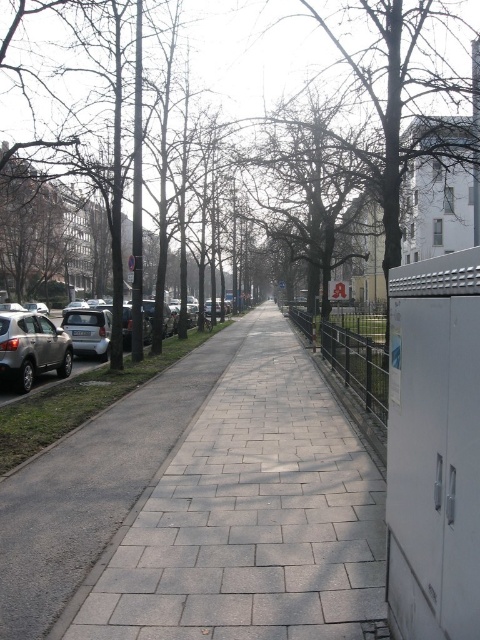
Between satin silver suv at left and silver metallic car at left, which one has less height?

With less height is satin silver suv at left.

Between satin silver suv at left and silver metallic car at left, which one appears on the right side from the viewer's perspective?

From the viewer's perspective, silver metallic car at left appears more on the right side.

Does point (21, 320) come in front of point (86, 362)?

Yes, point (21, 320) is in front of point (86, 362).

Locate an element on the screen. The width and height of the screenshot is (480, 640). satin silver suv at left is located at coordinates [x=32, y=348].

Does gray concrete pavement at center have a lesser width compared to metallic wire fence at center-right?

Yes, gray concrete pavement at center is thinner than metallic wire fence at center-right.

Where is `gray concrete pavement at center`? The image size is (480, 640). gray concrete pavement at center is located at coordinates (249, 516).

Is point (219, 474) positioned before point (356, 387)?

Yes, point (219, 474) is in front of point (356, 387).

Find the location of a particular element. gray concrete pavement at center is located at coordinates (249, 516).

From the picture: Between gray concrete pavement at center and silver metallic car at left, which one has less height?

gray concrete pavement at center is shorter.

Between gray concrete pavement at center and silver metallic car at left, which one has more height?

silver metallic car at left

Find the location of a particular element. Image resolution: width=480 pixels, height=640 pixels. gray concrete pavement at center is located at coordinates (249, 516).